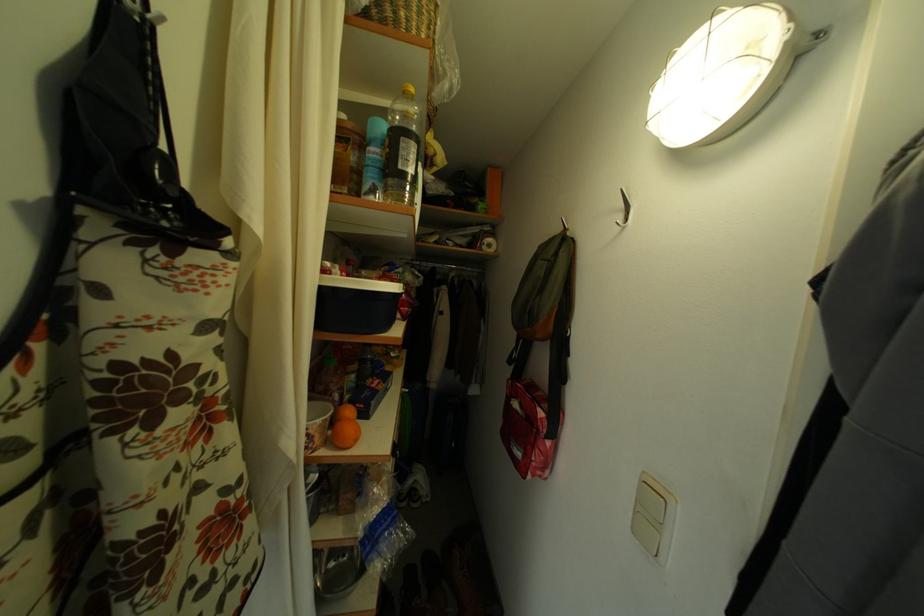
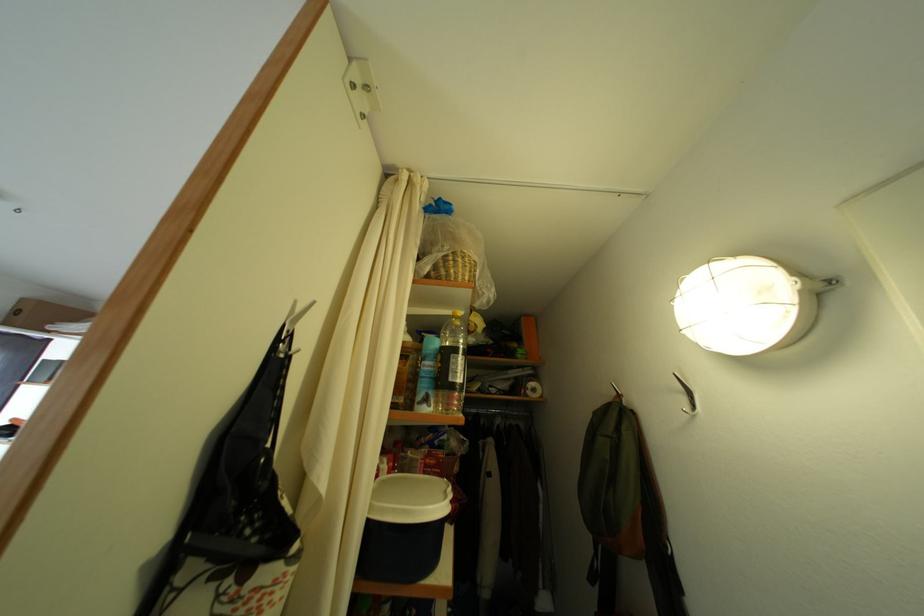
Find the pixel in the second image that matches (410,159) in the first image.

(460, 373)